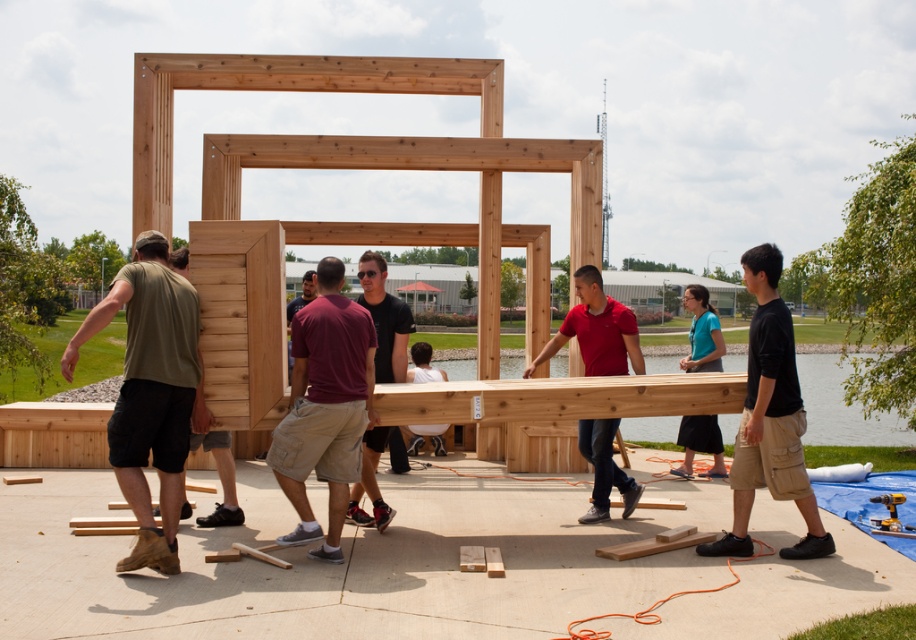
Question: Based on their relative distances, which object is nearer to the green fabric shirt at left?

Choices:
 (A) teal fabric shirt at center
 (B) matte black shirt at center
 (C) maroon fabric shirt at center
 (D) natural wood frame at center

Answer: (C)

Question: Can you confirm if natural wood frame at center is positioned above teal fabric shirt at center?

Choices:
 (A) yes
 (B) no

Answer: (A)

Question: Is matte red shirt at center smaller than matte black shirt at center?

Choices:
 (A) no
 (B) yes

Answer: (A)

Question: Among these objects, which one is nearest to the camera?

Choices:
 (A) maroon fabric shirt at center
 (B) natural wood frame at center

Answer: (A)

Question: Can you confirm if matte green t-shirt at left is bigger than matte red shirt at center?

Choices:
 (A) no
 (B) yes

Answer: (B)

Question: Considering the real-world distances, which object is farthest from the matte green t-shirt at left?

Choices:
 (A) matte red shirt at center
 (B) green fabric shirt at left
 (C) black cotton t-shirt at center
 (D) maroon fabric shirt at center

Answer: (C)